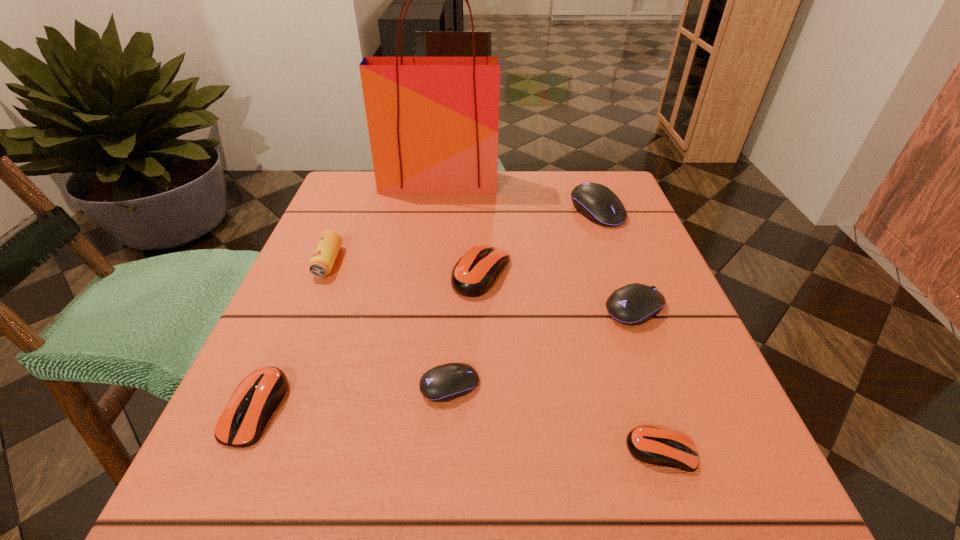
This screenshot has height=540, width=960. I want to click on vacant point located between the second biggest black computer mouse and the farthest orange computer mouse, so click(x=558, y=291).

Locate an element on the screen. The image size is (960, 540). blank region between the leftmost orange computer mouse and the tallest computer mouse is located at coordinates (426, 309).

Locate an element on the screen. free spot between the farthest black computer mouse and the tallest object is located at coordinates (517, 197).

You are a GUI agent. You are given a task and a screenshot of the screen. Output one action in this format:
    pyautogui.click(x=<x>, y=<y>)
    Task: Click on the free space between the nearest black computer mouse and the shortest object
    
    Given the screenshot: What is the action you would take?
    pyautogui.click(x=556, y=418)

Locate an element on the screen. free space between the beer can and the second orange computer mouse from right to left is located at coordinates (405, 267).

This screenshot has width=960, height=540. Find the location of `free space that is in between the second biggest orange computer mouse and the nearest black computer mouse`. free space that is in between the second biggest orange computer mouse and the nearest black computer mouse is located at coordinates (352, 397).

Where is `object that is the sixth closest to the farthest orange computer mouse`? This screenshot has height=540, width=960. object that is the sixth closest to the farthest orange computer mouse is located at coordinates (255, 399).

Locate an element on the screen. the second closest object to the smallest black computer mouse is located at coordinates (255, 399).

Identify which computer mouse is located as the fourth nearest to the biggest black computer mouse. Please provide its 2D coordinates. Your answer should be formatted as a tuple, i.e. [(x, y)], where the tuple contains the x and y coordinates of a point satisfying the conditions above.

[(652, 445)]

This screenshot has width=960, height=540. Identify the location of computer mouse that is the closest to the leftmost computer mouse. (446, 382).